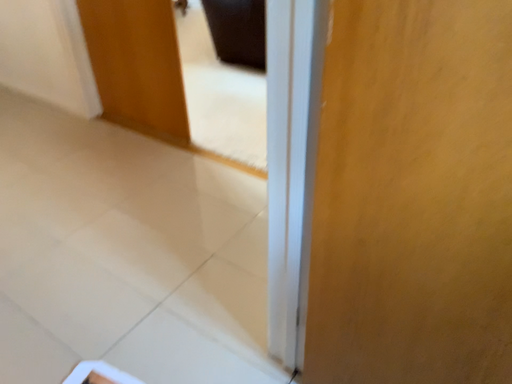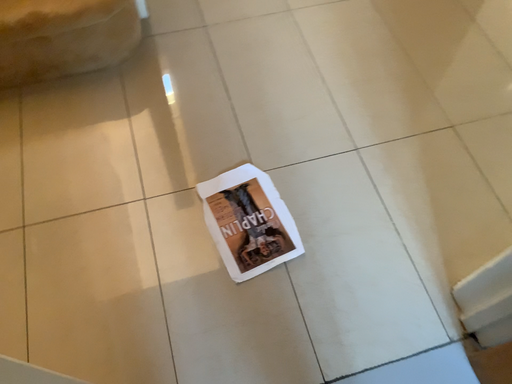
Question: Which way did the camera rotate in the video?

Choices:
 (A) rotated downward
 (B) rotated upward

Answer: (A)